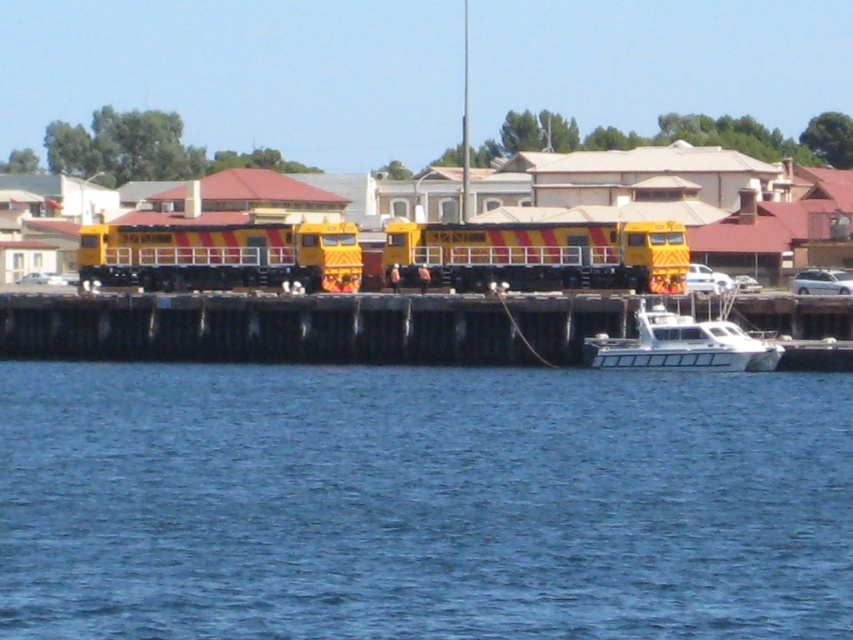
Question: Which point is farther to the camera?

Choices:
 (A) (442, 344)
 (B) (628, 358)
 (C) (115, 554)

Answer: (A)

Question: From the image, what is the correct spatial relationship of blue water at lower center in relation to white glossy boat at lower right?

Choices:
 (A) right
 (B) left

Answer: (B)

Question: Which is nearer to the white glossy boat at lower right?

Choices:
 (A) blue water at lower center
 (B) wooden dock at center

Answer: (B)

Question: Is wooden dock at center positioned at the back of white glossy boat at lower right?

Choices:
 (A) no
 (B) yes

Answer: (A)

Question: Does blue water at lower center have a lesser width compared to yellow painted metal train at center?

Choices:
 (A) yes
 (B) no

Answer: (B)

Question: Which object appears closest to the camera in this image?

Choices:
 (A) white glossy boat at lower right
 (B) blue water at lower center
 (C) yellow painted metal train at center

Answer: (B)